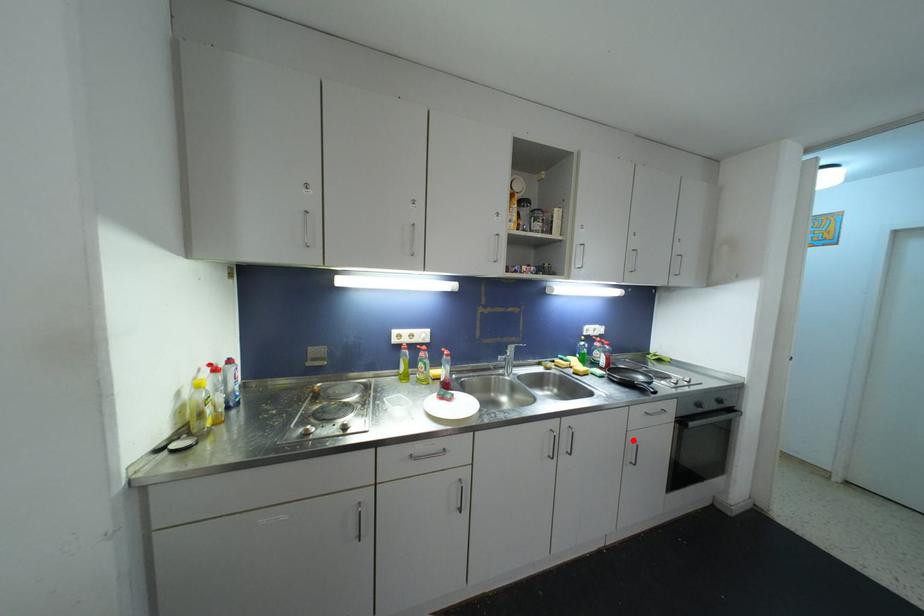
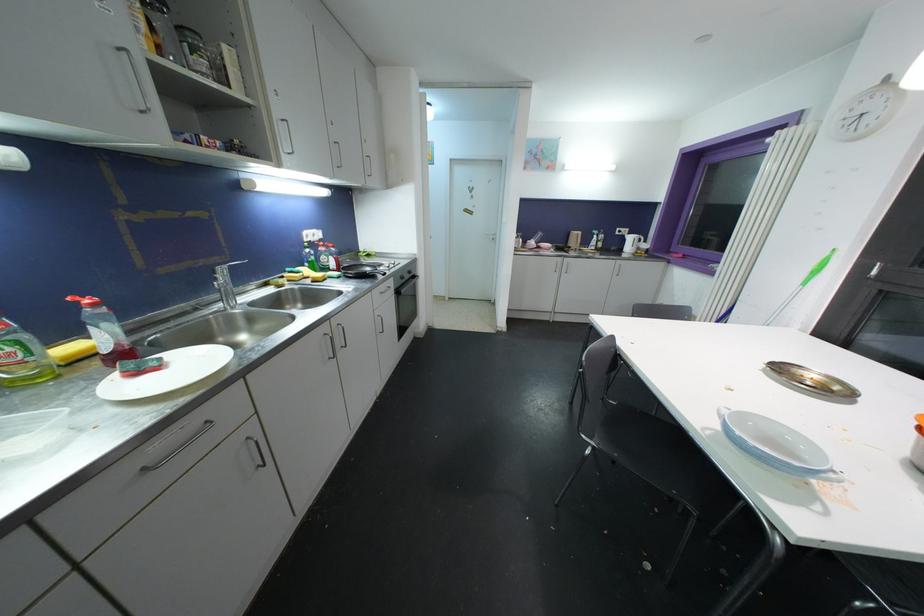
Question: A red point is marked in image1. In image2, is the corresponding 3D point closer to the camera or farther? Reply with the corresponding letter.

Choices:
 (A) The corresponding 3D point is closer.
 (B) The corresponding 3D point is farther.

Answer: (A)